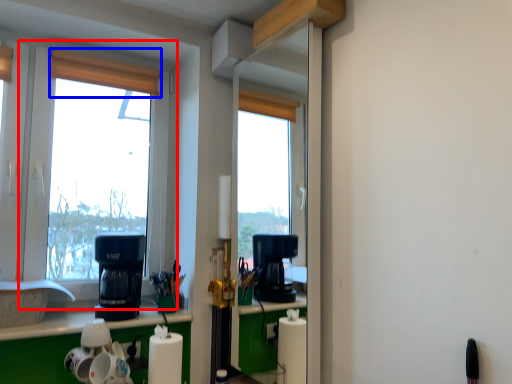
Question: Which of the following is the farthest to the observer, window (highlighted by a red box) or curtain (highlighted by a blue box)?

Choices:
 (A) window
 (B) curtain

Answer: (B)